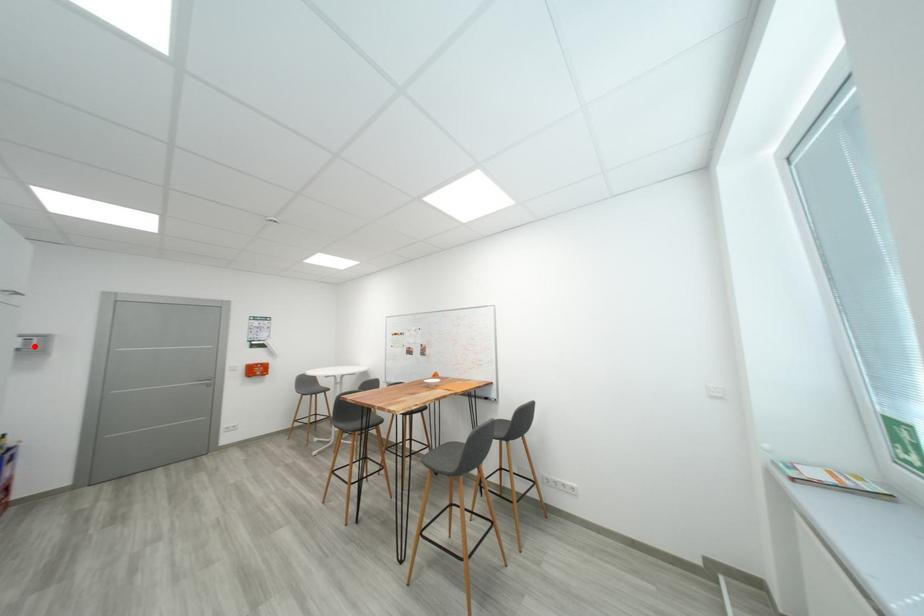
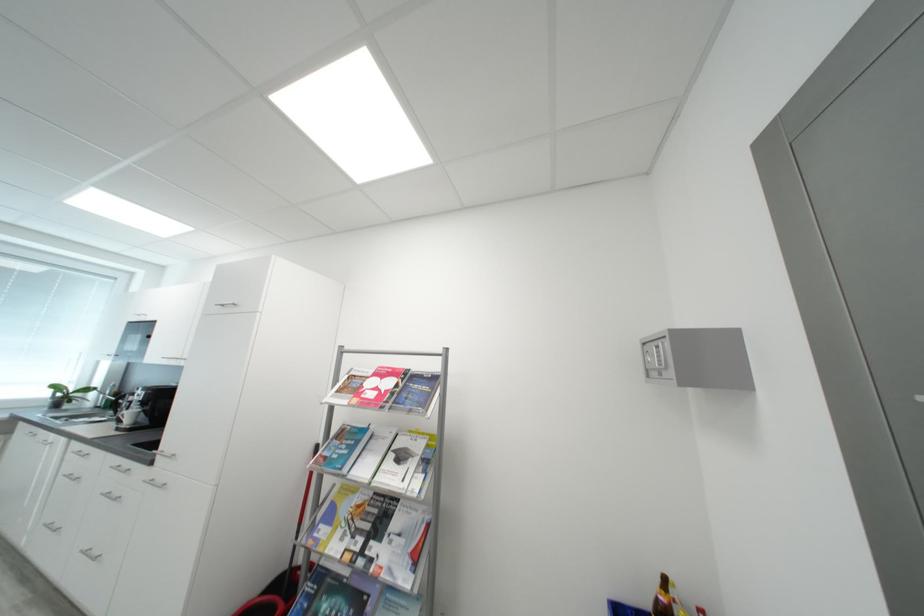
Find the pixel in the second image that matches the highlighted location in the first image.

(666, 362)